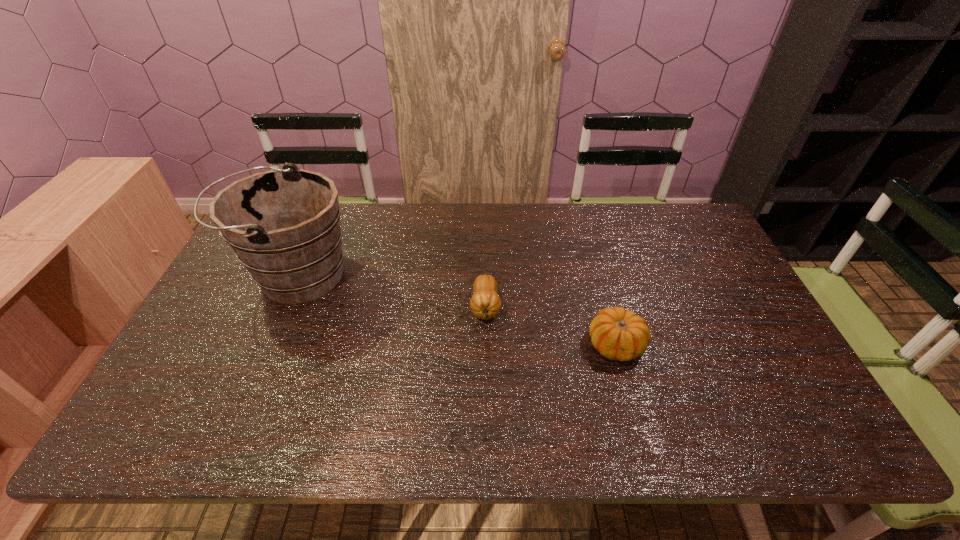
You are a GUI agent. You are given a task and a screenshot of the screen. Output one action in this format:
    pyautogui.click(x=<x>, y=<y>)
    Task: Click on the free space between the right gourd and the bucket
    Image resolution: width=960 pixels, height=540 pixels.
    Given the screenshot: What is the action you would take?
    pyautogui.click(x=457, y=309)

Where is `vacant area that lies between the right gourd and the bucket`? The image size is (960, 540). vacant area that lies between the right gourd and the bucket is located at coordinates (457, 309).

Find the location of a particular element. The image size is (960, 540). free space between the second object from left to right and the tallest object is located at coordinates (392, 291).

Where is `free space between the rightmost object and the bucket`? Image resolution: width=960 pixels, height=540 pixels. free space between the rightmost object and the bucket is located at coordinates (457, 309).

Locate an element on the screen. vacant area between the rightmost object and the second object from right to left is located at coordinates (551, 326).

What are the coordinates of `object that is the nearest to the right gourd` in the screenshot? It's located at (485, 303).

Select which object is the second closest to the bucket. Please provide its 2D coordinates. Your answer should be formatted as a tuple, i.e. [(x, y)], where the tuple contains the x and y coordinates of a point satisfying the conditions above.

[(617, 334)]

At what (x,y) coordinates should I click in order to perform the action: click on vacant space that satisfies the following two spatial constraints: 1. on the stem side of the left gourd; 2. on the left side of the right gourd. Please return your answer as a coordinate pair (x, y). The width and height of the screenshot is (960, 540). Looking at the image, I should click on (486, 345).